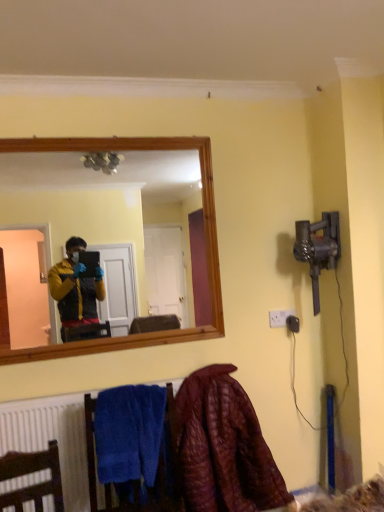
The width and height of the screenshot is (384, 512). What do you see at coordinates (279, 317) in the screenshot? I see `white plastic electric outlet at lower right` at bounding box center [279, 317].

What is the approximate width of white plastic electric outlet at lower right?

white plastic electric outlet at lower right is 1.56 inches in width.

Measure the distance between point [189,398] and camera.

Point [189,398] and camera are 2.04 meters apart.

Find the location of a particular element. This screenshot has height=512, width=384. white plastic electric outlet at lower right is located at coordinates click(279, 317).

From a real-world perspective, which object rests below the other?

velvet maroon blanket at lower right, from a real-world perspective.

Consider the image. What's the angular difference between velvet maroon blanket at lower right and white plastic electric outlet at lower right's facing directions?

0.00406 degrees.

Does velvet maroon blanket at lower right lie in front of white plastic electric outlet at lower right?

Yes, the depth of velvet maroon blanket at lower right is less than that of white plastic electric outlet at lower right.

Considering the sizes of objects velvet maroon blanket at lower right and white plastic electric outlet at lower right in the image provided, who is smaller, velvet maroon blanket at lower right or white plastic electric outlet at lower right?

With smaller size is white plastic electric outlet at lower right.

From a real-world perspective, between white plastic electric outlet at lower right and blue soft towel at lower left, who is vertically higher?

white plastic electric outlet at lower right.

Can you confirm if white plastic electric outlet at lower right is shorter than blue soft towel at lower left?

Indeed, white plastic electric outlet at lower right has a lesser height compared to blue soft towel at lower left.

Is white plastic electric outlet at lower right next to blue soft towel at lower left and touching it?

No, white plastic electric outlet at lower right is not with blue soft towel at lower left.

In the image, is white plastic electric outlet at lower right on the left side or the right side of blue soft towel at lower left?

From the image, it's evident that white plastic electric outlet at lower right is to the right of blue soft towel at lower left.

Is point (172, 442) farther from viewer compared to point (290, 312)?

No, (172, 442) is in front of (290, 312).

Who is more distant, blue soft towel at lower left or white plastic electric outlet at lower right?

white plastic electric outlet at lower right is behind.

From the image's perspective, which is above, blue soft towel at lower left or white plastic electric outlet at lower right?

From the image's view, white plastic electric outlet at lower right is above.

Find the location of a particular element. electric outlet behind the blue soft towel at lower left is located at coordinates coord(279,317).

Can you confirm if white plastic electric outlet at lower right is positioned to the left of velvet maroon blanket at lower right?

No.

Is white plastic electric outlet at lower right next to velvet maroon blanket at lower right?

white plastic electric outlet at lower right and velvet maroon blanket at lower right are not in contact.

In the scene shown: Is velvet maroon blanket at lower right bigger than blue soft towel at lower left?

Yes, velvet maroon blanket at lower right is bigger than blue soft towel at lower left.

This screenshot has height=512, width=384. Find the location of `blanket to the right of blue soft towel at lower left`. blanket to the right of blue soft towel at lower left is located at coordinates (223, 447).

Does velvet maroon blanket at lower right have a greater width compared to blue soft towel at lower left?

Correct, the width of velvet maroon blanket at lower right exceeds that of blue soft towel at lower left.

From a real-world perspective, is velvet maroon blanket at lower right positioned over blue soft towel at lower left based on gravity?

No.

From a real-world perspective, is blue soft towel at lower left over velvet maroon blanket at lower right?

Yes, from a real-world perspective, blue soft towel at lower left is over velvet maroon blanket at lower right

Which object is wider, blue soft towel at lower left or velvet maroon blanket at lower right?

velvet maroon blanket at lower right is wider.

This screenshot has height=512, width=384. Identify the location of blanket lying below the blue soft towel at lower left (from the image's perspective). (223, 447).

Does point (86, 409) come farther from viewer compared to point (259, 437)?

That is False.

You are a GUI agent. You are given a task and a screenshot of the screen. Output one action in this format:
    pyautogui.click(x=<x>, y=<y>)
    Task: Click on the electric outlet above the velvet maroon blanket at lower right (from a real-world perspective)
    The height and width of the screenshot is (512, 384).
    Given the screenshot: What is the action you would take?
    pyautogui.click(x=279, y=317)

The height and width of the screenshot is (512, 384). Find the location of `electric outlet to the right of blue soft towel at lower left`. electric outlet to the right of blue soft towel at lower left is located at coordinates (279, 317).

Considering their positions, is white plastic electric outlet at lower right positioned further to blue soft towel at lower left than velvet maroon blanket at lower right?

white plastic electric outlet at lower right is positioned further to the anchor blue soft towel at lower left.

From the image, which object appears to be farther from blue soft towel at lower left, velvet maroon blanket at lower right or white plastic electric outlet at lower right?

Based on the image, white plastic electric outlet at lower right appears to be further to blue soft towel at lower left.

Looking at this image, based on their spatial positions, is velvet maroon blanket at lower right or blue soft towel at lower left further from white plastic electric outlet at lower right?

blue soft towel at lower left.

In the scene shown: Based on their spatial positions, is white plastic electric outlet at lower right or blue soft towel at lower left closer to velvet maroon blanket at lower right?

blue soft towel at lower left lies closer to velvet maroon blanket at lower right than the other object.

From the image, which object appears to be nearer to white plastic electric outlet at lower right, blue soft towel at lower left or velvet maroon blanket at lower right?

velvet maroon blanket at lower right is positioned closer to the anchor white plastic electric outlet at lower right.

Based on their spatial positions, is blue soft towel at lower left or white plastic electric outlet at lower right further from velvet maroon blanket at lower right?

Among the two, white plastic electric outlet at lower right is located further to velvet maroon blanket at lower right.

Find the location of a particular element. This screenshot has width=384, height=512. blanket located between blue soft towel at lower left and white plastic electric outlet at lower right in the left-right direction is located at coordinates (223, 447).